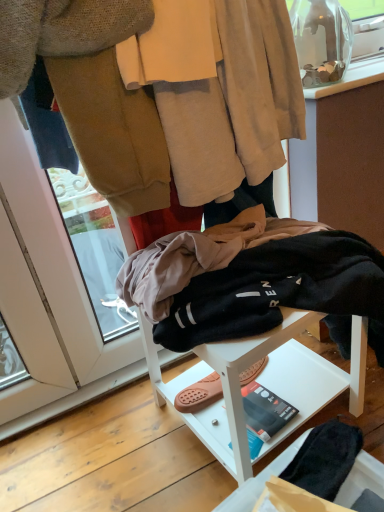
Question: Is beige soft fabric robe at upper center bigger than white matte stool at center?

Choices:
 (A) no
 (B) yes

Answer: (A)

Question: Is beige soft fabric robe at upper center thinner than white matte stool at center?

Choices:
 (A) yes
 (B) no

Answer: (A)

Question: From the image's perspective, is beige soft fabric robe at upper center located beneath white matte stool at center?

Choices:
 (A) no
 (B) yes

Answer: (A)

Question: Considering the relative positions of beige soft fabric robe at upper center and white matte stool at center in the image provided, is beige soft fabric robe at upper center in front of white matte stool at center?

Choices:
 (A) yes
 (B) no

Answer: (B)

Question: Does beige soft fabric robe at upper center have a smaller size compared to white matte stool at center?

Choices:
 (A) yes
 (B) no

Answer: (A)

Question: Is beige soft fabric robe at upper center to the left of white matte stool at center from the viewer's perspective?

Choices:
 (A) yes
 (B) no

Answer: (A)

Question: Is white matte stool at center positioned beyond the bounds of beige soft fabric robe at upper center?

Choices:
 (A) no
 (B) yes

Answer: (B)

Question: Considering the relative sizes of white matte stool at center and beige soft fabric robe at upper center in the image provided, is white matte stool at center bigger than beige soft fabric robe at upper center?

Choices:
 (A) no
 (B) yes

Answer: (B)

Question: From the image's perspective, is white matte stool at center located beneath beige soft fabric robe at upper center?

Choices:
 (A) yes
 (B) no

Answer: (A)

Question: From a real-world perspective, is white matte stool at center on beige soft fabric robe at upper center?

Choices:
 (A) no
 (B) yes

Answer: (A)

Question: Does white matte stool at center have a greater width compared to beige soft fabric robe at upper center?

Choices:
 (A) yes
 (B) no

Answer: (A)

Question: Can you confirm if white matte stool at center is thinner than beige soft fabric robe at upper center?

Choices:
 (A) yes
 (B) no

Answer: (B)

Question: From a real-world perspective, relative to white matte stool at center, is beige soft fabric robe at upper center vertically above or below?

Choices:
 (A) below
 (B) above

Answer: (B)